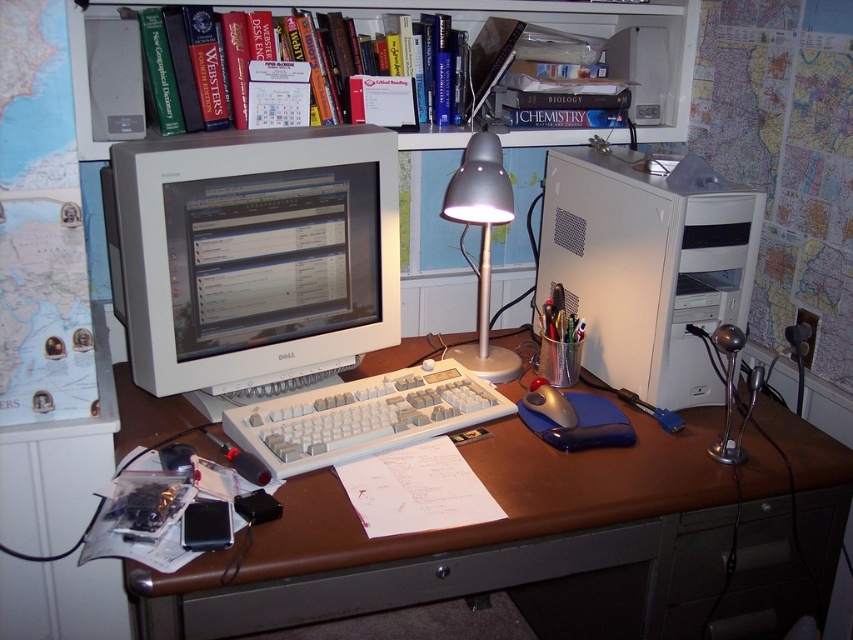
Which is behind, point (608, 276) or point (444, 72)?

The point (444, 72) is more distant.

Who is higher up, white plastic computer tower at center-right or hardcover book at upper center?

hardcover book at upper center is above.

Does point (717, 289) come farther from viewer compared to point (392, 124)?

No, it is not.

Locate an element on the screen. The height and width of the screenshot is (640, 853). white plastic computer tower at center-right is located at coordinates (648, 266).

Between point (195, 224) and point (538, 410), which one is positioned in front?

Point (195, 224) is in front.

Which is in front, point (296, 188) or point (556, 410)?

Point (296, 188) is in front.

Locate an element on the screen. The height and width of the screenshot is (640, 853). white plastic monitor at center is located at coordinates (253, 257).

Does brown leather desk at center appear on the right side of white plastic monitor at center?

Correct, you'll find brown leather desk at center to the right of white plastic monitor at center.

Is brown leather desk at center smaller than white plastic monitor at center?

Actually, brown leather desk at center might be larger than white plastic monitor at center.

The image size is (853, 640). Describe the element at coordinates (485, 547) in the screenshot. I see `brown leather desk at center` at that location.

Locate an element on the screen. The height and width of the screenshot is (640, 853). brown leather desk at center is located at coordinates (485, 547).